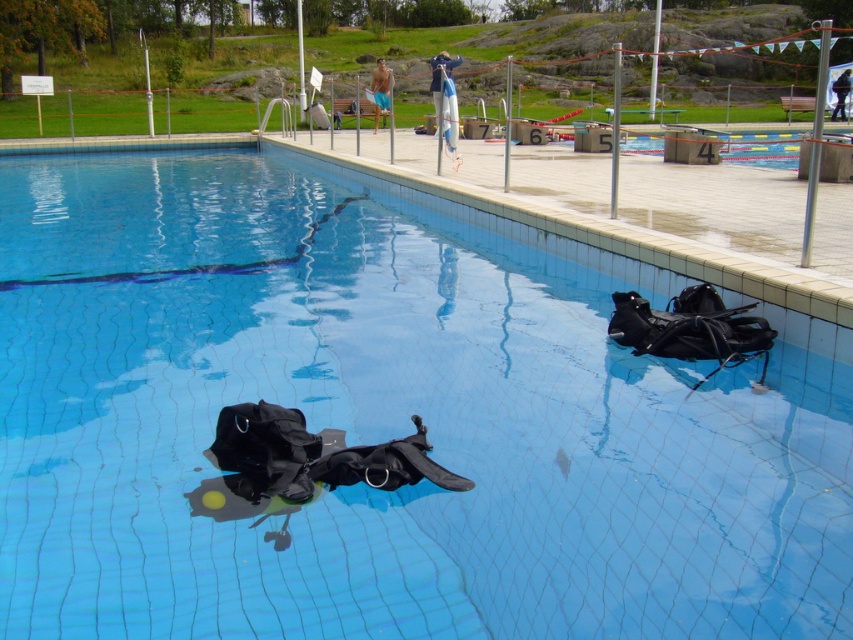
Is point (386, 96) closer to camera compared to point (842, 76)?

Yes, it is.

Between blue fabric shorts at upper center and black fabric backpack at lower center, which one is positioned lower?

black fabric backpack at lower center

Describe the element at coordinates (380, 90) in the screenshot. I see `blue fabric shorts at upper center` at that location.

The image size is (853, 640). Identify the location of blue fabric shorts at upper center. (380, 90).